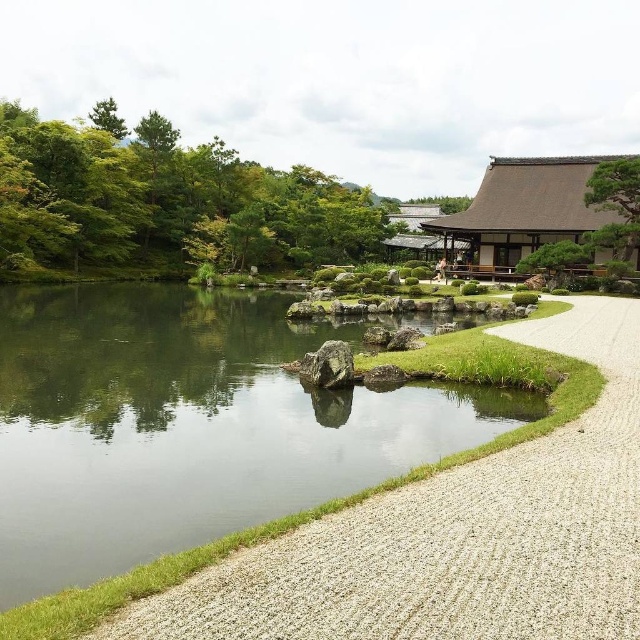
Question: Can you confirm if green leafy tree at upper left is positioned to the right of brown/wooden temple at upper center?

Choices:
 (A) yes
 (B) no

Answer: (B)

Question: Which point is farther to the camera?

Choices:
 (A) (586, 220)
 (B) (579, 451)

Answer: (A)

Question: Does gravel at lower right have a larger size compared to brown/wooden temple at upper center?

Choices:
 (A) no
 (B) yes

Answer: (A)

Question: Can you confirm if gravel at lower right is smaller than green leafy tree at upper left?

Choices:
 (A) no
 (B) yes

Answer: (B)

Question: Among these objects, which one is nearest to the camera?

Choices:
 (A) gravel at lower right
 (B) green textured tree at upper right
 (C) green leafy tree at upper left
 (D) brown/wooden temple at upper center

Answer: (A)

Question: Among these objects, which one is farthest from the camera?

Choices:
 (A) green textured tree at upper right
 (B) green leafy tree at upper left

Answer: (B)